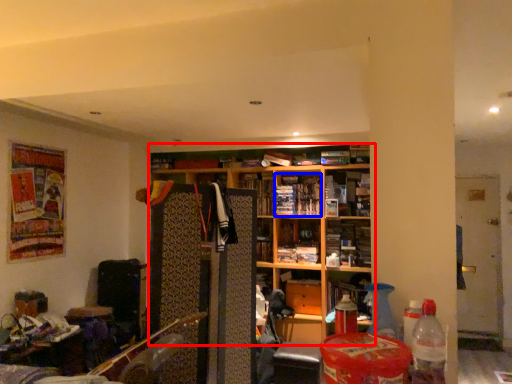
Question: Which object appears closest to the camera in this image, shelf (highlighted by a red box) or book (highlighted by a blue box)?

Choices:
 (A) shelf
 (B) book

Answer: (A)